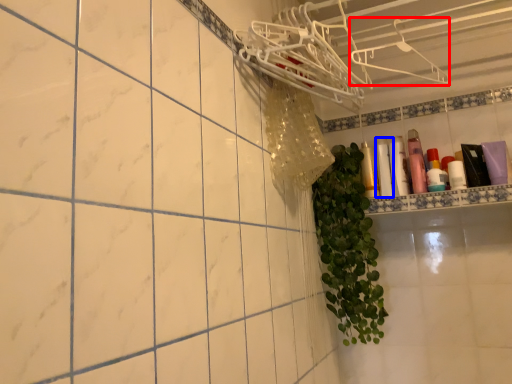
Question: Among these objects, which one is nearest to the camera, hanger (highlighted by a red box) or toiletry (highlighted by a blue box)?

Choices:
 (A) hanger
 (B) toiletry

Answer: (A)